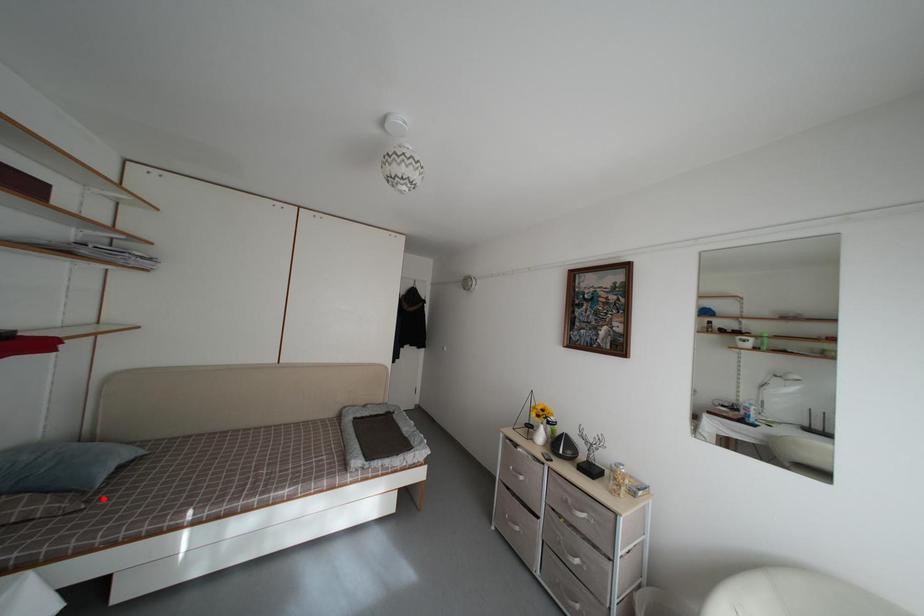
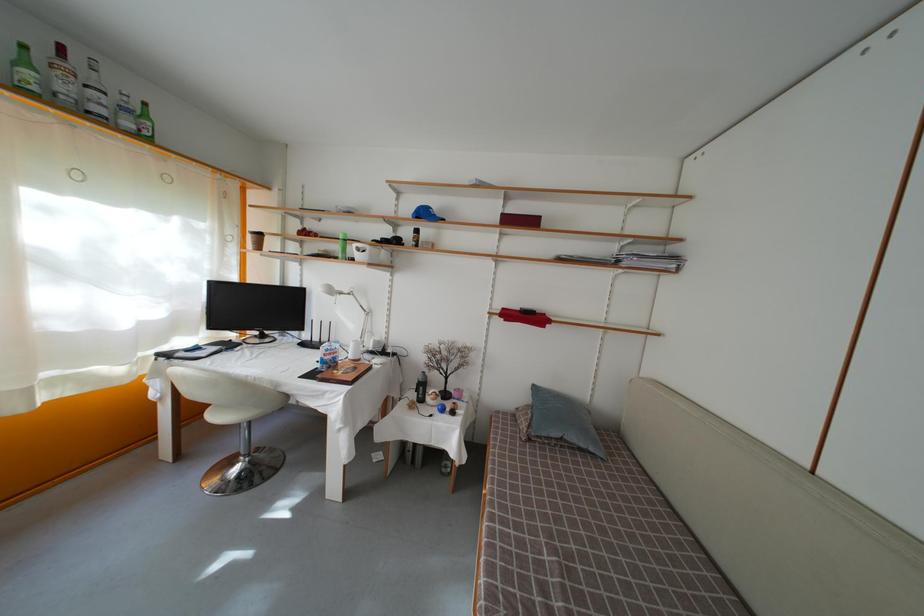
Where in the second image is the point corresponding to the highlighted location from the first image?

(550, 450)